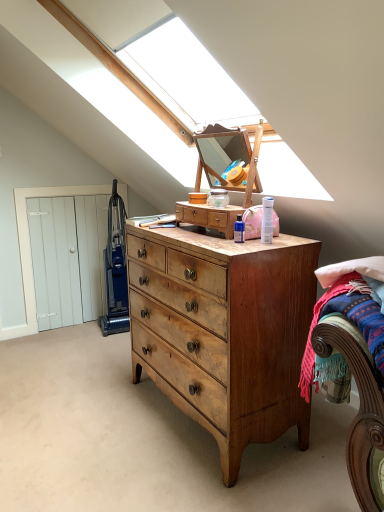
Question: From the image's perspective, is blue plastic vacuum cleaner at left under wooden bed at lower right?

Choices:
 (A) no
 (B) yes

Answer: (A)

Question: Is blue plastic vacuum cleaner at left directly adjacent to wooden bed at lower right?

Choices:
 (A) yes
 (B) no

Answer: (B)

Question: From a real-world perspective, is blue plastic vacuum cleaner at left on wooden bed at lower right?

Choices:
 (A) no
 (B) yes

Answer: (A)

Question: Is blue plastic vacuum cleaner at left positioned behind wooden bed at lower right?

Choices:
 (A) no
 (B) yes

Answer: (B)

Question: From the image's perspective, is blue plastic vacuum cleaner at left on wooden bed at lower right?

Choices:
 (A) no
 (B) yes

Answer: (B)

Question: Does blue plastic vacuum cleaner at left have a lesser width compared to wooden bed at lower right?

Choices:
 (A) yes
 (B) no

Answer: (B)

Question: Can you confirm if wooden bed at lower right is taller than light brown wood chest of drawers at center?

Choices:
 (A) no
 (B) yes

Answer: (A)

Question: Does wooden bed at lower right have a lesser width compared to light brown wood chest of drawers at center?

Choices:
 (A) yes
 (B) no

Answer: (A)

Question: Is light brown wood chest of drawers at center completely or partially inside wooden bed at lower right?

Choices:
 (A) yes
 (B) no

Answer: (B)

Question: Is wooden bed at lower right at the right side of light brown wood chest of drawers at center?

Choices:
 (A) yes
 (B) no

Answer: (A)

Question: Is wooden bed at lower right placed right next to light brown wood chest of drawers at center?

Choices:
 (A) yes
 (B) no

Answer: (B)

Question: From the image's perspective, is wooden bed at lower right on top of light brown wood chest of drawers at center?

Choices:
 (A) no
 (B) yes

Answer: (A)

Question: Considering the relative sizes of blue plastic vacuum cleaner at left and light brown wood dresser at center in the image provided, is blue plastic vacuum cleaner at left taller than light brown wood dresser at center?

Choices:
 (A) yes
 (B) no

Answer: (A)